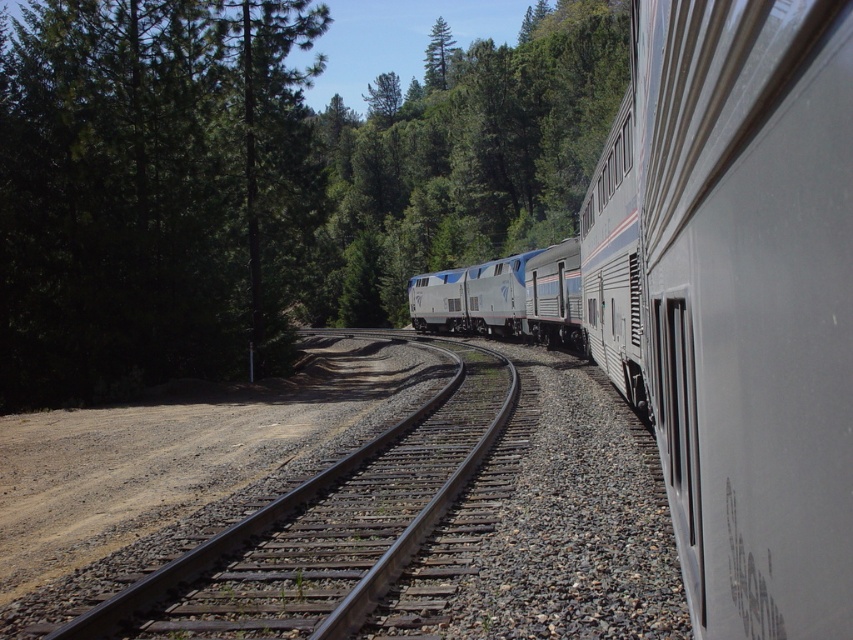
Question: Does green leafy tree at upper left have a greater width compared to black metal train track at center?

Choices:
 (A) yes
 (B) no

Answer: (A)

Question: Can you confirm if green leafy tree at upper left is wider than black metal train track at center?

Choices:
 (A) yes
 (B) no

Answer: (A)

Question: Estimate the real-world distances between objects in this image. Which object is farther from the black metal train track at center?

Choices:
 (A) silver metallic train at center
 (B) green leafy tree at upper left

Answer: (B)

Question: Can you confirm if green leafy tree at upper left is wider than silver metallic train at center?

Choices:
 (A) no
 (B) yes

Answer: (B)

Question: Among these objects, which one is farthest from the camera?

Choices:
 (A) green leafy tree at upper left
 (B) silver metallic train at center
 (C) black metal train track at center

Answer: (A)

Question: Which object is the closest to the silver metallic train at center?

Choices:
 (A) black metal train track at center
 (B) green leafy tree at upper left

Answer: (A)